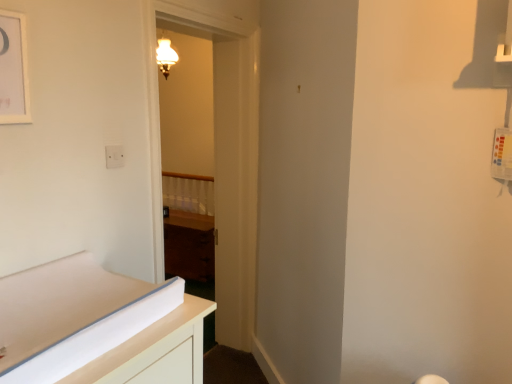
Describe the element at coordinates (231, 153) in the screenshot. The height and width of the screenshot is (384, 512). I see `wooden door at center` at that location.

The image size is (512, 384). What do you see at coordinates (188, 193) in the screenshot?
I see `wooden at center` at bounding box center [188, 193].

Find the location of `white matte picture frame at upper left`. white matte picture frame at upper left is located at coordinates (13, 69).

The width and height of the screenshot is (512, 384). Describe the element at coordinates (98, 327) in the screenshot. I see `white glossy changing table at lower left` at that location.

Where is `matte brass sconce at upper center`? The width and height of the screenshot is (512, 384). matte brass sconce at upper center is located at coordinates (165, 56).

Is white plastic electric outlet at upper left thinner than dark wood cabinet at center?

Yes.

Considering the sizes of objects white plastic electric outlet at upper left and dark wood cabinet at center in the image provided, who is taller, white plastic electric outlet at upper left or dark wood cabinet at center?

Standing taller between the two is dark wood cabinet at center.

In terms of size, does white plastic electric outlet at upper left appear bigger or smaller than dark wood cabinet at center?

Clearly, white plastic electric outlet at upper left is smaller in size than dark wood cabinet at center.

How much distance is there between white plastic electric outlet at upper left and dark wood cabinet at center?

A distance of 7.42 feet exists between white plastic electric outlet at upper left and dark wood cabinet at center.

Is wooden door at center behind dark wood cabinet at center?

No, wooden door at center is in front of dark wood cabinet at center.

Considering the sizes of objects wooden door at center and dark wood cabinet at center in the image provided, who is taller, wooden door at center or dark wood cabinet at center?

wooden door at center.

Between wooden door at center and dark wood cabinet at center, which one has larger size?

With larger size is wooden door at center.

What's the angular difference between wooden door at center and dark wood cabinet at center's facing directions?

The facing directions of wooden door at center and dark wood cabinet at center are 88 degrees apart.

Based on the photo, in terms of height, does dark wood cabinet at center look taller or shorter compared to white glossy changing table at lower left?

dark wood cabinet at center is taller than white glossy changing table at lower left.

Is dark wood cabinet at center far from white glossy changing table at lower left?

That's right, there is a large distance between dark wood cabinet at center and white glossy changing table at lower left.

How different are the orientations of dark wood cabinet at center and white glossy changing table at lower left in degrees?

Answer: There is a 88.6-degree angle between the facing directions of dark wood cabinet at center and white glossy changing table at lower left.

What's the angular difference between wooden at center and white glossy changing table at lower left's facing directions?

The angle between the facing direction of wooden at center and the facing direction of white glossy changing table at lower left is 88.6 degrees.

From a real-world perspective, which object rests below the other?

In real-world perspective, wooden at center is lower.

Considering the sizes of objects wooden at center and white glossy changing table at lower left in the image provided, who is bigger, wooden at center or white glossy changing table at lower left?

wooden at center.

Based on the photo, is wooden at center outside of white glossy changing table at lower left?

Absolutely, wooden at center is external to white glossy changing table at lower left.

From a real-world perspective, does matte brass sconce at upper center stand above dark wood cabinet at center?

Correct, in the physical world, matte brass sconce at upper center is higher than dark wood cabinet at center.

Which object is further away from the camera taking this photo, matte brass sconce at upper center or dark wood cabinet at center?

matte brass sconce at upper center is behind.

From the image's perspective, would you say matte brass sconce at upper center is positioned over dark wood cabinet at center?

Yes, from the image's perspective, matte brass sconce at upper center is over dark wood cabinet at center.

Based on the photo, does dark wood cabinet at center have a larger size compared to white matte picture frame at upper left?

Indeed, dark wood cabinet at center has a larger size compared to white matte picture frame at upper left.

Can you confirm if dark wood cabinet at center is shorter than white matte picture frame at upper left?

No.

Does dark wood cabinet at center appear on the left side of white matte picture frame at upper left?

Yes.

Would you consider dark wood cabinet at center to be distant from white plastic electric outlet at upper left?

dark wood cabinet at center is far away from white plastic electric outlet at upper left.

From the image's perspective, which object appears higher, dark wood cabinet at center or white plastic electric outlet at upper left?

white plastic electric outlet at upper left appears higher in the image.

Does dark wood cabinet at center have a larger size compared to white plastic electric outlet at upper left?

Correct, dark wood cabinet at center is larger in size than white plastic electric outlet at upper left.

Is dark wood cabinet at center oriented towards white plastic electric outlet at upper left?

No, dark wood cabinet at center is not turned towards white plastic electric outlet at upper left.

Locate an element on the screen. This screenshot has width=512, height=384. electric outlet in front of the dark wood cabinet at center is located at coordinates (114, 156).

Locate an element on the screen. door above the dark wood cabinet at center (from the image's perspective) is located at coordinates (231, 153).

Looking at the image, which one is located further to dark wood cabinet at center, white matte picture frame at upper left or white plastic electric outlet at upper left?

white matte picture frame at upper left.

Based on the photo, considering their positions, is white plastic electric outlet at upper left positioned closer to matte brass sconce at upper center than white glossy changing table at lower left?

white plastic electric outlet at upper left is closer to matte brass sconce at upper center.

When comparing their distances from white matte picture frame at upper left, does wooden door at center or white plastic electric outlet at upper left seem further?

wooden door at center lies further to white matte picture frame at upper left than the other object.

From the image, which object appears to be farther from white glossy changing table at lower left, wooden at center or matte brass sconce at upper center?

matte brass sconce at upper center is positioned further to the anchor white glossy changing table at lower left.

When comparing their distances from matte brass sconce at upper center, does white glossy changing table at lower left or white plastic electric outlet at upper left seem further?

white glossy changing table at lower left is positioned further to the anchor matte brass sconce at upper center.

When comparing their distances from white glossy changing table at lower left, does dark wood cabinet at center or white matte picture frame at upper left seem further?

dark wood cabinet at center is positioned further to the anchor white glossy changing table at lower left.

From the image, which object appears to be nearer to white plastic electric outlet at upper left, dark wood cabinet at center or wooden at center?

dark wood cabinet at center is positioned closer to the anchor white plastic electric outlet at upper left.

Based on their spatial positions, is white glossy changing table at lower left or wooden at center further from dark wood cabinet at center?

white glossy changing table at lower left lies further to dark wood cabinet at center than the other object.

I want to click on picture frame between white glossy changing table at lower left and matte brass sconce at upper center in the front-back direction, so click(x=13, y=69).

Image resolution: width=512 pixels, height=384 pixels. Identify the location of cabinetry between white plastic electric outlet at upper left and wooden at center along the z-axis. (189, 246).

Locate an element on the screen. The image size is (512, 384). electric outlet between white glossy changing table at lower left and matte brass sconce at upper center in the front-back direction is located at coordinates (114, 156).

Identify the location of electric outlet between white matte picture frame at upper left and matte brass sconce at upper center from front to back. (114, 156).